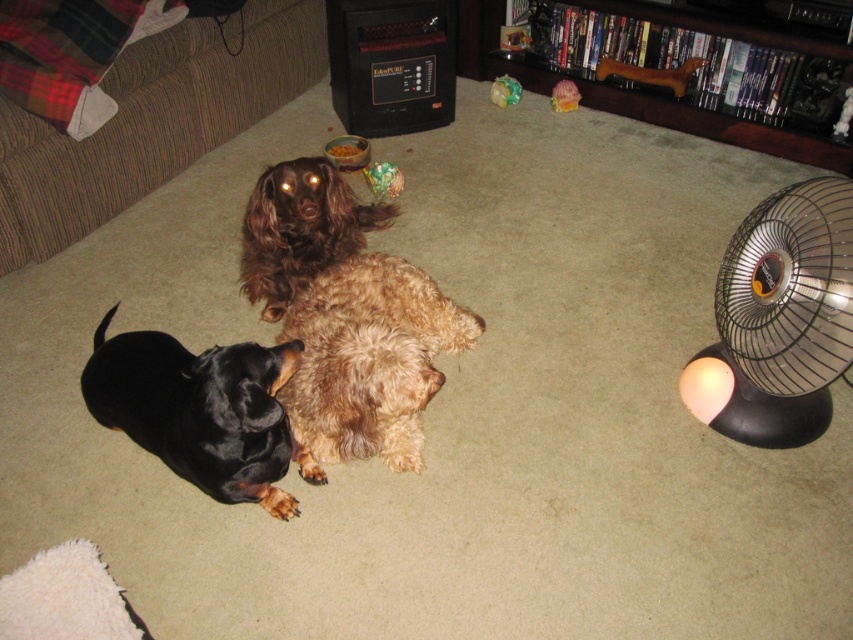
Question: Is brown fabric couch at upper left further to the viewer compared to plush green toy at upper center?

Choices:
 (A) no
 (B) yes

Answer: (A)

Question: Which object appears farthest from the camera in this image?

Choices:
 (A) black plastic fan at right
 (B) plush pink ball at center
 (C) plush multicolored toy at center

Answer: (B)

Question: Which of the following is the closest to the observer?

Choices:
 (A) brown fluffy dog at center
 (B) black shiny fur dog at lower left

Answer: (B)

Question: Which object appears closest to the camera in this image?

Choices:
 (A) black shiny fur dog at lower left
 (B) plush pink ball at center
 (C) black plastic fan at right

Answer: (A)

Question: Does brown fabric couch at upper left appear over fuzzy brown dog at center?

Choices:
 (A) yes
 (B) no

Answer: (A)

Question: Does black plastic fan at right appear on the right side of black shiny fur dog at lower left?

Choices:
 (A) no
 (B) yes

Answer: (B)